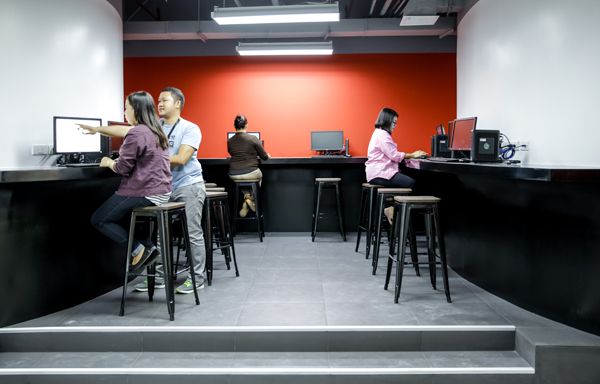
This screenshot has width=600, height=384. In order to click on white walls in this screenshot , I will do `click(530, 101)`, `click(63, 58)`.